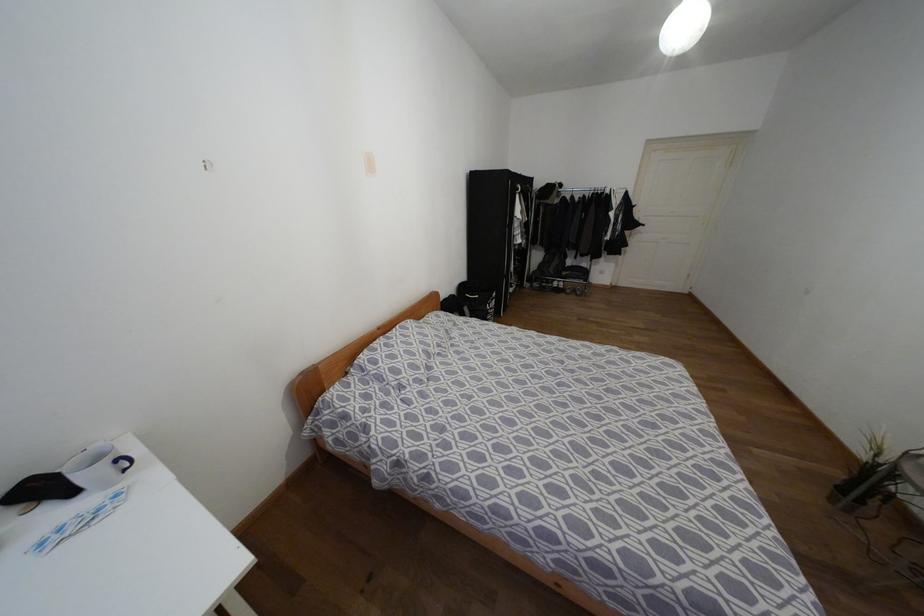
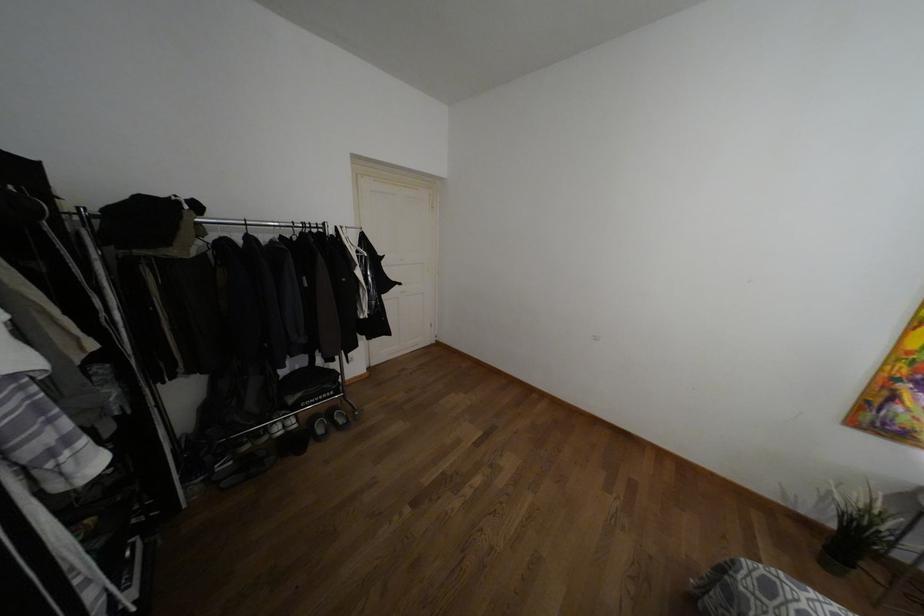
The point at (542, 284) is marked in the first image. Where is the corresponding point in the second image?

(246, 447)